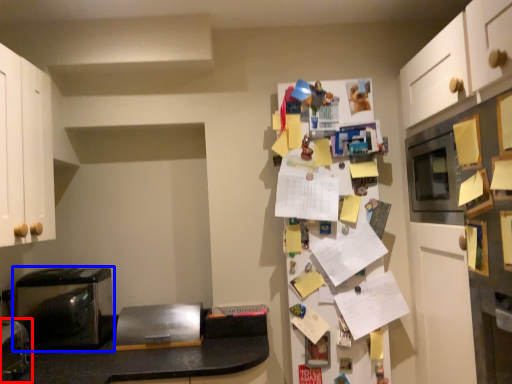
Question: Which point is closer to the camera, appliance (highlighted by a red box) or home appliance (highlighted by a blue box)?

Choices:
 (A) appliance
 (B) home appliance

Answer: (A)